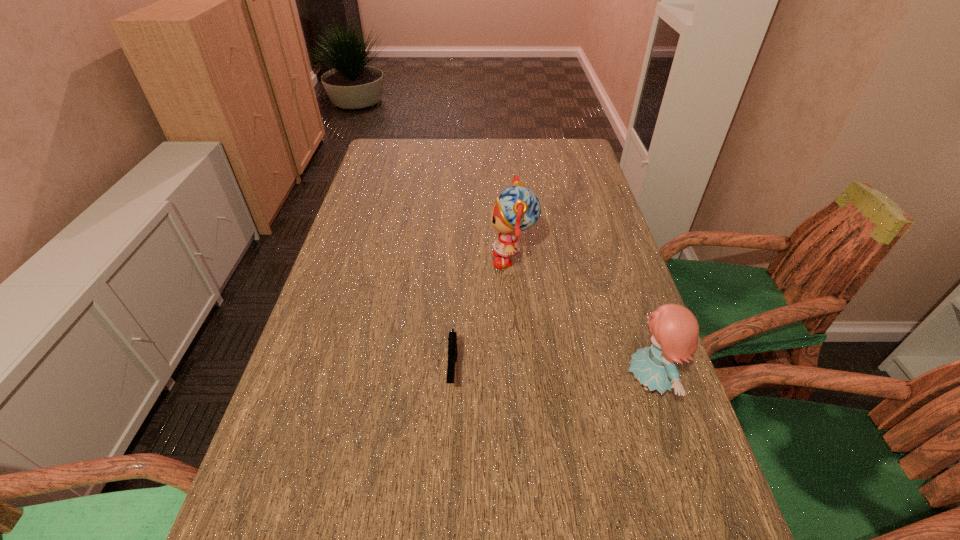
In order to click on free point that satisfies the following two spatial constraints: 1. on the face of the farther doll; 2. on the front-facing side of the leftmost object in this screenshot , I will do `click(522, 372)`.